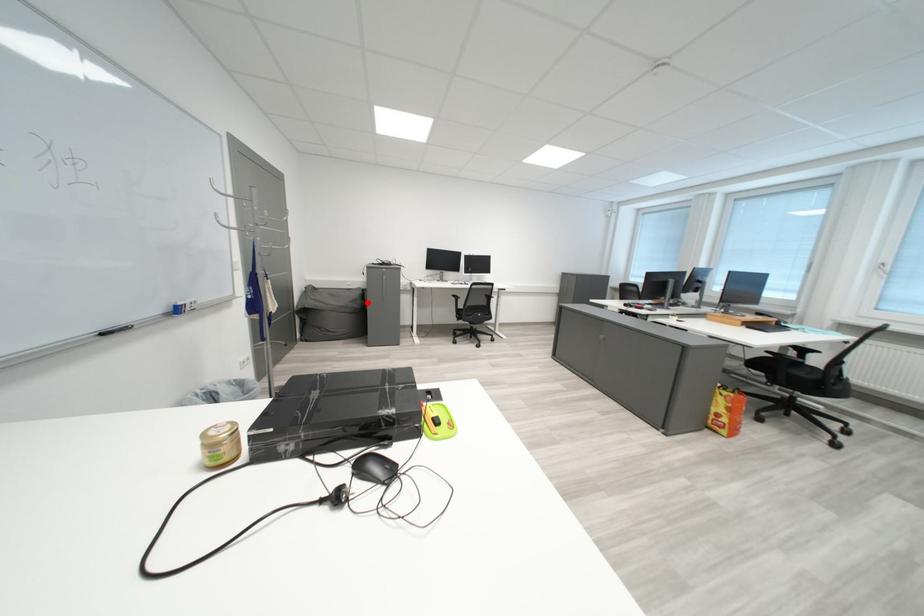
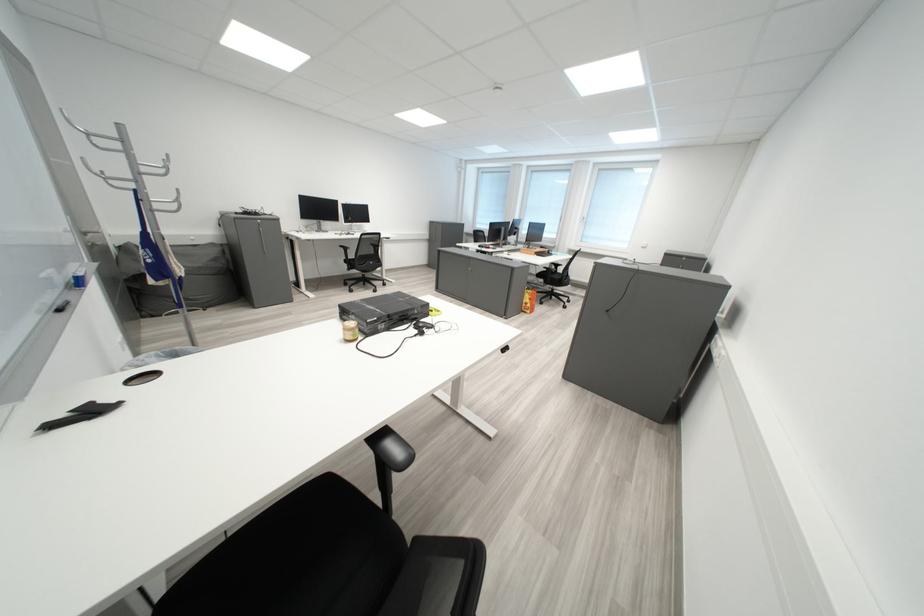
Question: I am providing you with two images of the same scene from different viewpoints. A red point is shown in image1. For the corresponding object point in image2, is it positioned nearer or farther from the camera?

Choices:
 (A) Nearer
 (B) Farther

Answer: (A)